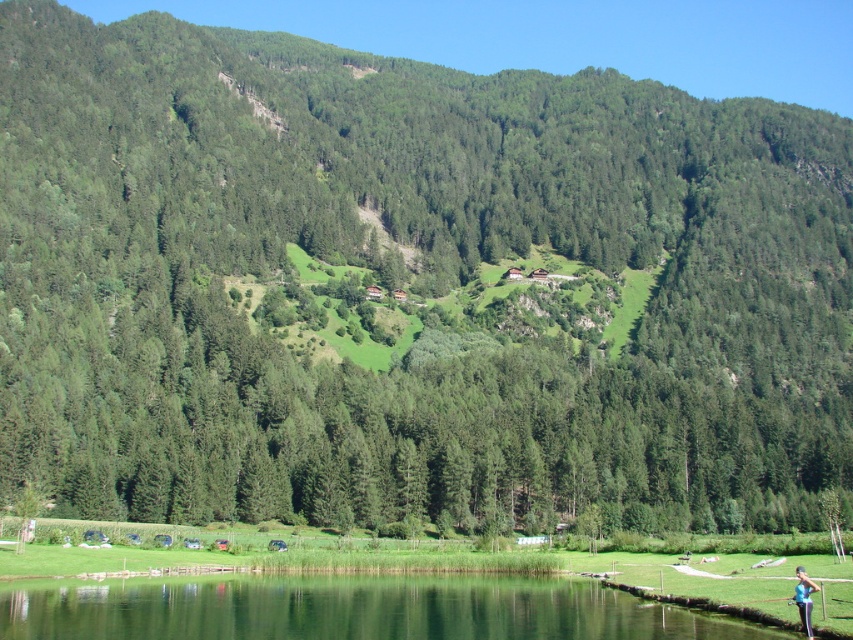
You are a hiker who wants to cross the green smooth water at lower center to reach a scenic viewpoint on the other side. However, you notice the blue fabric person at lower right standing nearby. Based on their position, can you safely walk directly towards the water from your current position without getting too close to the person?

The green smooth water at lower center is positioned under the blue fabric person at lower right, meaning the person is standing near the water. To avoid getting too close, you should approach the water from a different angle or path that keeps a safe distance from the blue fabric person at lower right.

You are standing at the edge of the green smooth water at lower center and want to take a photo of the blue fabric person at lower right. In which direction should you move to get them in your camera frame?

The green smooth water at lower center is to the left of blue fabric person at lower right, so you should move to your right to capture the blue fabric person at lower right in your frame.